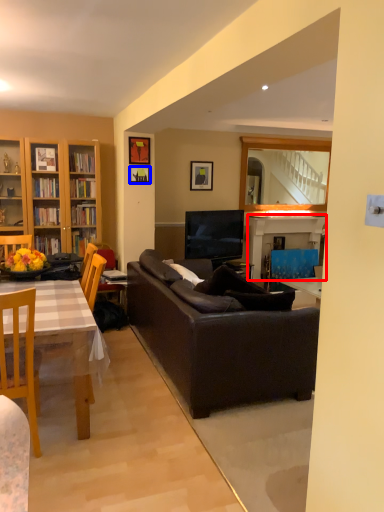
Question: Which object is closer to the camera taking this photo, fireplace (highlighted by a red box) or picture frame (highlighted by a blue box)?

Choices:
 (A) fireplace
 (B) picture frame

Answer: (B)